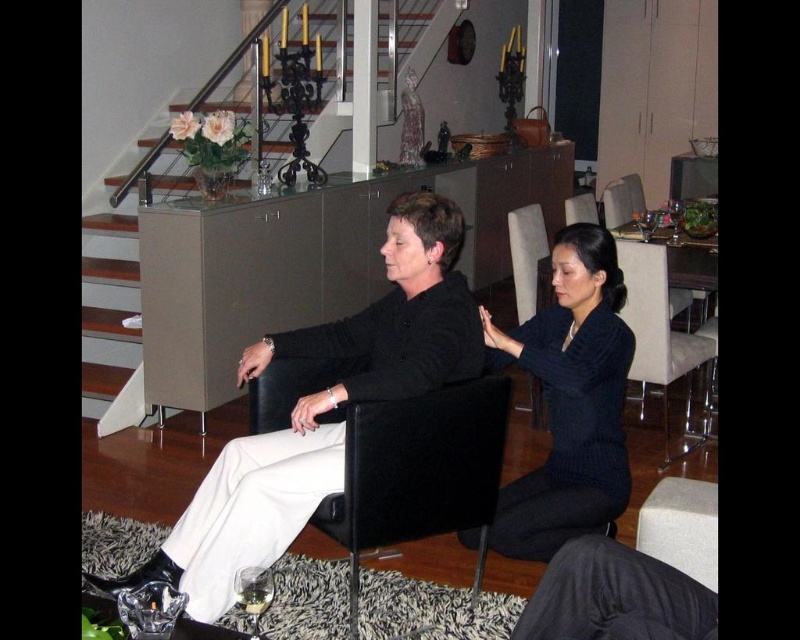
Question: Where is white wooden stairs at center located in relation to dark blue sweater at center in the image?

Choices:
 (A) above
 (B) below

Answer: (A)

Question: Which object is the farthest from the black leather armchair at center?

Choices:
 (A) white wooden stairs at center
 (B) velvet dark blue armchair at center
 (C) dark blue sweater at center
 (D) matte black chair at center

Answer: (B)

Question: Is matte black chair at center below velvet beige armchair at center?

Choices:
 (A) no
 (B) yes

Answer: (A)

Question: From the image, what is the correct spatial relationship of dark gray fabric pants at lower center in relation to velvet dark blue armchair at center?

Choices:
 (A) below
 (B) above

Answer: (A)

Question: Which point appears farthest from the camera in this image?

Choices:
 (A) (441, 528)
 (B) (176, 570)
 (C) (612, 186)

Answer: (C)

Question: Which point is closer to the camera?

Choices:
 (A) (421, 189)
 (B) (644, 209)
 (C) (437, 467)
 (D) (705, 436)

Answer: (C)